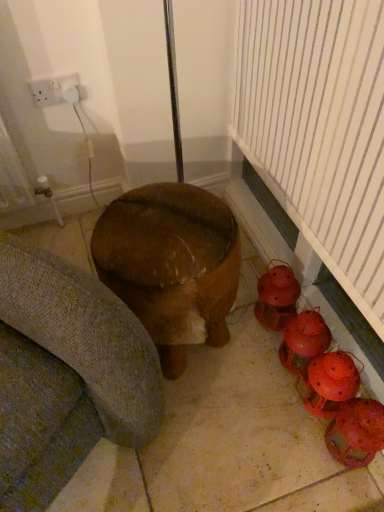
Question: Based on their sizes in the image, would you say matte orange lanterns at lower right, placed as the second toy when sorted from bottom to top, is bigger or smaller than wooden stool at center?

Choices:
 (A) small
 (B) big

Answer: (A)

Question: Is matte orange lanterns at lower right, placed as the second toy when sorted from bottom to top, wider or thinner than wooden stool at center?

Choices:
 (A) wide
 (B) thin

Answer: (B)

Question: Estimate the real-world distances between objects in this image. Which object is closer to the matte orange lanterns at lower right, placed as the second toy when sorted from bottom to top?

Choices:
 (A) white plastic socket at upper left
 (B) matte red lantern at lower right, the 3th toy from the bottom
 (C) wooden stool at center
 (D) brown polished wood stool at center
 (E) matte red lantern at lower right, marked as the 4th toy in a top-to-bottom arrangement

Answer: (B)

Question: Which is nearer to the brown polished wood stool at center?

Choices:
 (A) matte red lantern at lower right, the 2th toy viewed from the top
 (B) matte orange lanterns at lower right, arranged as the third toy when viewed from the top
 (C) wooden stool at center
 (D) matte red lantern at lower right, acting as the 1th toy starting from the bottom
 (E) matte red lantern at lower right, the 4th toy in the bottom-to-top sequence

Answer: (B)